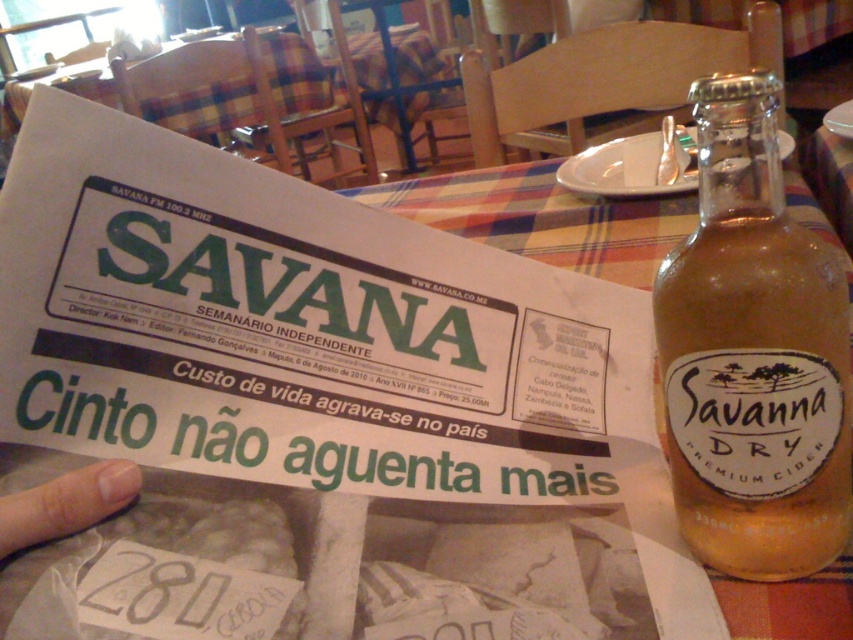
Can you confirm if translucent glass bottle at upper right is taller than flesh-toned skin at lower left?

Yes.

Looking at this image, is translucent glass bottle at upper right wider than flesh-toned skin at lower left?

Correct, the width of translucent glass bottle at upper right exceeds that of flesh-toned skin at lower left.

Where is `translucent glass bottle at upper right`? Image resolution: width=853 pixels, height=640 pixels. translucent glass bottle at upper right is located at coordinates (753, 355).

Find the location of a particular element. The image size is (853, 640). translucent glass bottle at upper right is located at coordinates (753, 355).

Can you confirm if translucent glass bottle at upper right is thinner than plaid fabric table at upper center?

Yes, translucent glass bottle at upper right is thinner than plaid fabric table at upper center.

Can you confirm if translucent glass bottle at upper right is smaller than plaid fabric table at upper center?

Correct, translucent glass bottle at upper right occupies less space than plaid fabric table at upper center.

Between point (740, 262) and point (155, 56), which one is positioned behind?

The point (155, 56) is behind.

Locate an element on the screen. translucent glass bottle at upper right is located at coordinates (753, 355).

In the scene shown: Does plaid fabric table at upper center come behind flesh-toned skin at lower left?

That is True.

Between point (117, 93) and point (16, 522), which one is positioned behind?

The point (117, 93) is more distant.

I want to click on plaid fabric table at upper center, so pos(204,106).

Where is `plaid fabric table at upper center`? This screenshot has width=853, height=640. plaid fabric table at upper center is located at coordinates (204, 106).